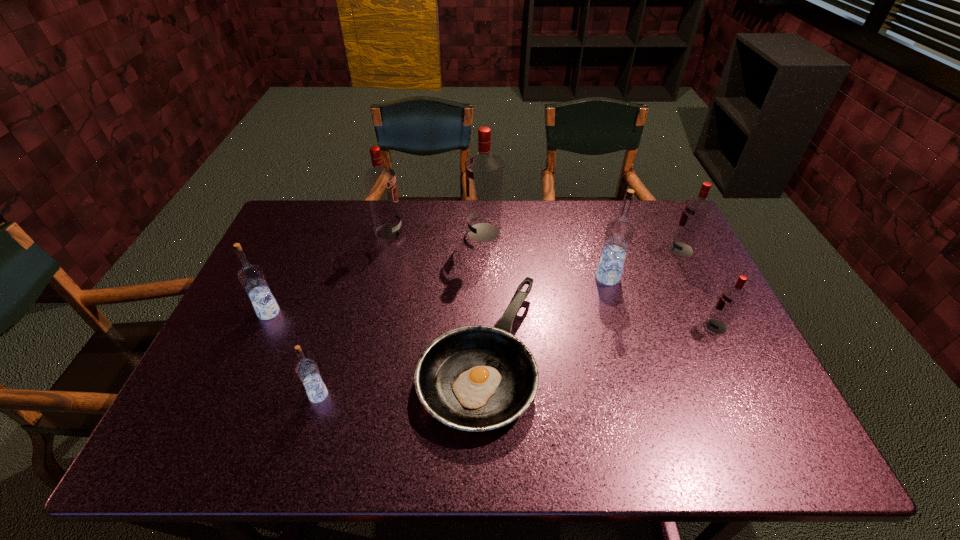
Locate an element on the screen. blank area located on the front label of the second smallest red vodka is located at coordinates (631, 249).

What are the coordinates of `free space located on the front label of the second smallest red vodka` in the screenshot? It's located at (654, 249).

Find the location of a particular element. free location located 0.090m on the front label of the second smallest red vodka is located at coordinates [640, 249].

This screenshot has height=540, width=960. Find the location of `vacant area situated 0.210m on the front label of the smallest red vodka`. vacant area situated 0.210m on the front label of the smallest red vodka is located at coordinates (626, 326).

Locate an element on the screen. The width and height of the screenshot is (960, 540). free spot located 0.270m on the front label of the smallest red vodka is located at coordinates (604, 326).

You are a GUI agent. You are given a task and a screenshot of the screen. Output one action in this format:
    pyautogui.click(x=<x>, y=<y>)
    Task: Click on the vacant region located on the front label of the smallest red vodka
    
    Given the screenshot: What is the action you would take?
    pyautogui.click(x=679, y=326)

Find the location of a particular element. free location located on the right of the nearest blue vodka is located at coordinates (428, 395).

You are a GUI agent. You are given a task and a screenshot of the screen. Output one action in this format:
    pyautogui.click(x=<x>, y=<y>)
    Task: Click on the free spot located 0.120m on the right of the shortest object
    Image resolution: width=960 pixels, height=540 pixels.
    Given the screenshot: What is the action you would take?
    tap(588, 355)

The height and width of the screenshot is (540, 960). What are the coordinates of `object located in the near edge section of the desktop` in the screenshot? It's located at (475, 378).

At what (x,y) coordinates should I click in order to perform the action: click on object that is at the left edge. Please return your answer as a coordinate pair (x, y). This screenshot has height=540, width=960. Looking at the image, I should click on (251, 277).